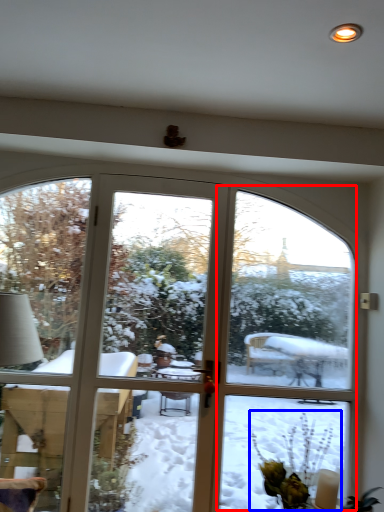
Question: Which object appears farthest to the camera in this image, screen door (highlighted by a red box) or floral arrangement (highlighted by a blue box)?

Choices:
 (A) screen door
 (B) floral arrangement

Answer: (A)